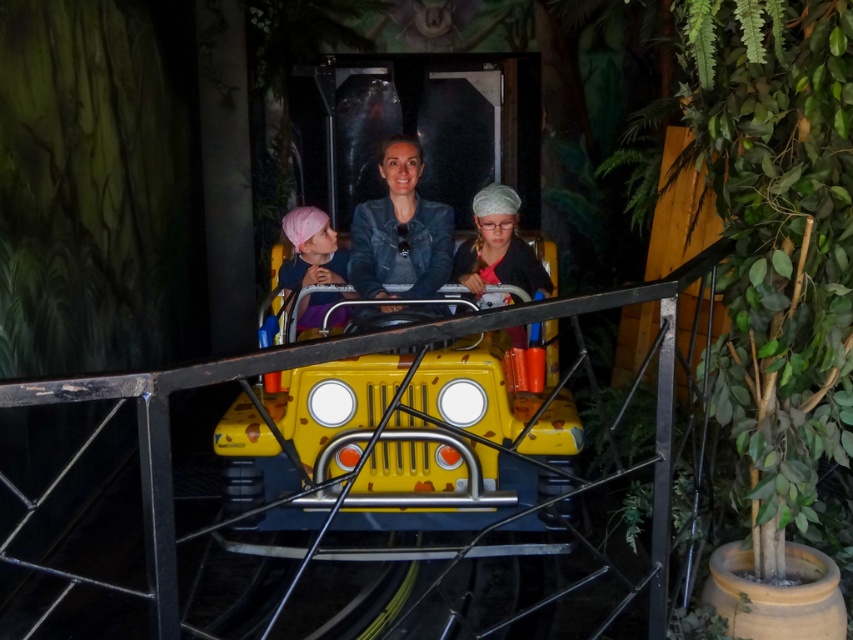
Does matte black car at center appear on the right side of pink fabric headband at left?

Indeed, matte black car at center is positioned on the right side of pink fabric headband at left.

Can you confirm if matte black car at center is taller than pink fabric headband at left?

Yes.

You are a GUI agent. You are given a task and a screenshot of the screen. Output one action in this format:
    pyautogui.click(x=<x>, y=<y>)
    Task: Click on the matte black car at center
    
    Given the screenshot: What is the action you would take?
    pyautogui.click(x=399, y=230)

In order to click on matte black car at center in this screenshot , I will do `click(399, 230)`.

Who is higher up, matte black car at center or denim jacket at center?

denim jacket at center is above.

Does matte black car at center have a lesser height compared to denim jacket at center?

No.

Identify the location of matte black car at center. (399, 230).

Where is `matte black car at center`? The image size is (853, 640). matte black car at center is located at coordinates click(x=399, y=230).

Which is behind, point (419, 152) or point (312, 298)?

Positioned behind is point (419, 152).

Can you confirm if denim jacket at center is wider than pink fabric headband at left?

Yes.

Who is more forward, (451,243) or (315,214)?

Point (315,214)

Where is `denim jacket at center`? This screenshot has height=640, width=853. denim jacket at center is located at coordinates (399, 230).